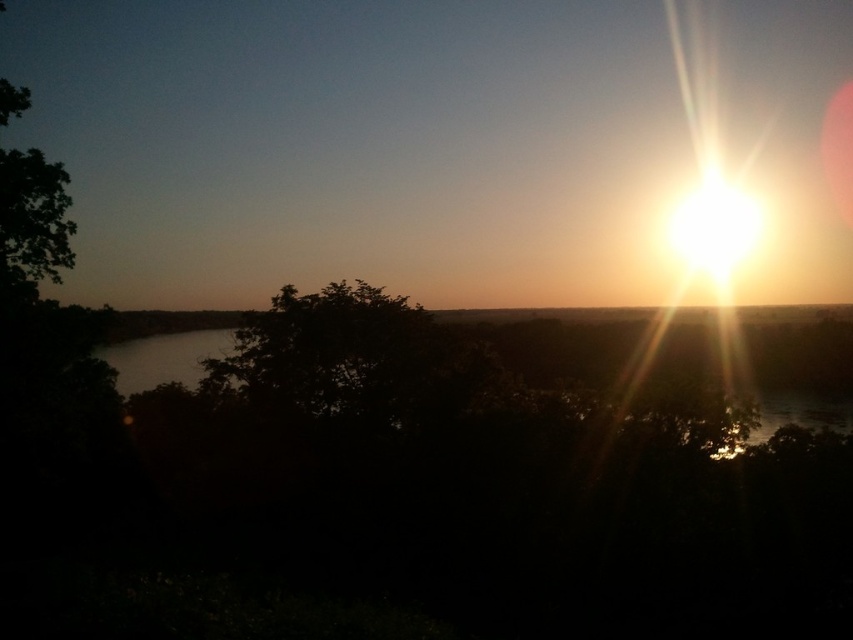
Question: Is dark green leafy tree at center above green leafy tree at upper left?

Choices:
 (A) yes
 (B) no

Answer: (B)

Question: Which of the following is the closest to the observer?

Choices:
 (A) (361, 380)
 (B) (38, 275)

Answer: (B)

Question: In this image, where is dark green leafy tree at center located relative to green leafy tree at upper left?

Choices:
 (A) above
 (B) below

Answer: (B)

Question: Does dark green leafy tree at center have a larger size compared to green leafy tree at upper left?

Choices:
 (A) yes
 (B) no

Answer: (A)

Question: Which point appears farthest from the camera in this image?

Choices:
 (A) (0, 280)
 (B) (426, 356)

Answer: (B)